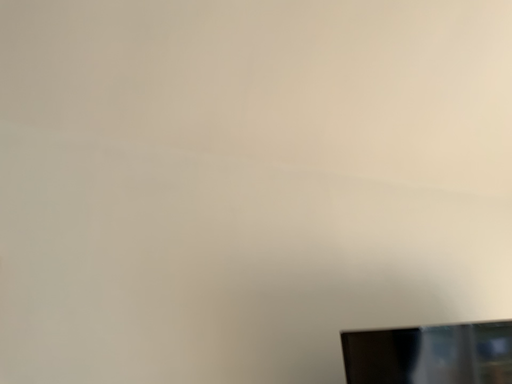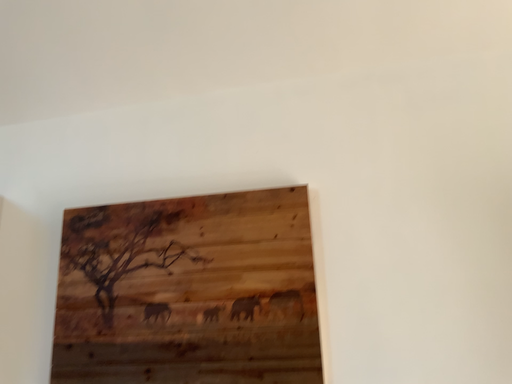
Question: Which way did the camera rotate in the video?

Choices:
 (A) rotated upward
 (B) rotated downward

Answer: (B)